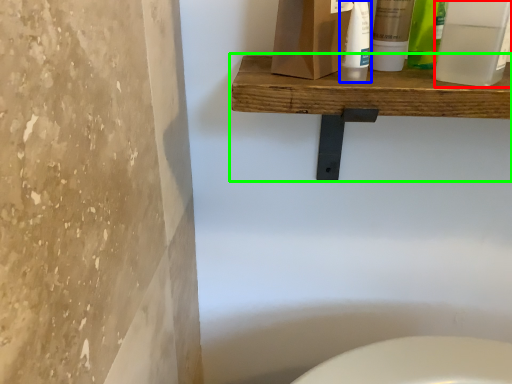
Question: Estimate the real-world distances between objects in this image. Which object is farther from mouthwash (highlighted by a red box), cleaning product (highlighted by a blue box) or shelf (highlighted by a green box)?

Choices:
 (A) cleaning product
 (B) shelf

Answer: (B)